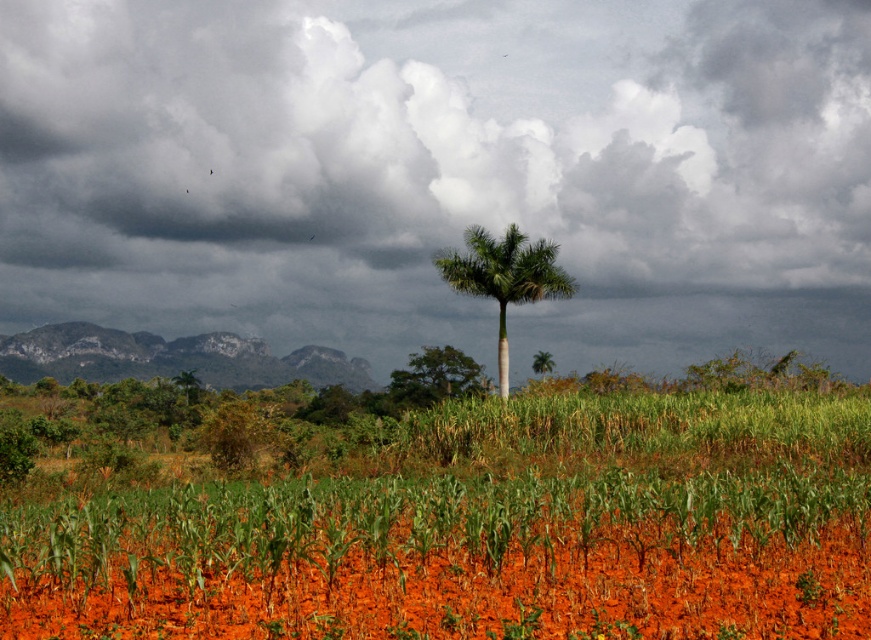
Looking at this image, can you confirm if rocky cliff at left is shorter than green leafy tree at center?

No.

Measure the distance from rocky cliff at left to green leafy tree at center.

73.48 feet

Which is in front, point (281, 364) or point (464, 384)?

Positioned in front is point (464, 384).

Image resolution: width=871 pixels, height=640 pixels. Find the location of `rocky cliff at left`. rocky cliff at left is located at coordinates (170, 358).

Looking at this image, how distant is red clay soil at center from green leafy palm at center?

red clay soil at center and green leafy palm at center are 29.90 meters apart.

Is the position of red clay soil at center less distant than that of green leafy palm at center?

Yes, it is.

Find the location of a particular element. red clay soil at center is located at coordinates (448, 557).

Identify the location of red clay soil at center. (x=448, y=557).

Measure the distance between point (502, 625) and camera.

They are 24.22 feet apart.

Between red clay soil at center and green leafy tree at center, which one has more height?

Standing taller between the two is green leafy tree at center.

Between point (458, 493) and point (444, 396), which one is positioned in front?

Point (458, 493)

Identify the location of red clay soil at center. This screenshot has width=871, height=640. [x=448, y=557].